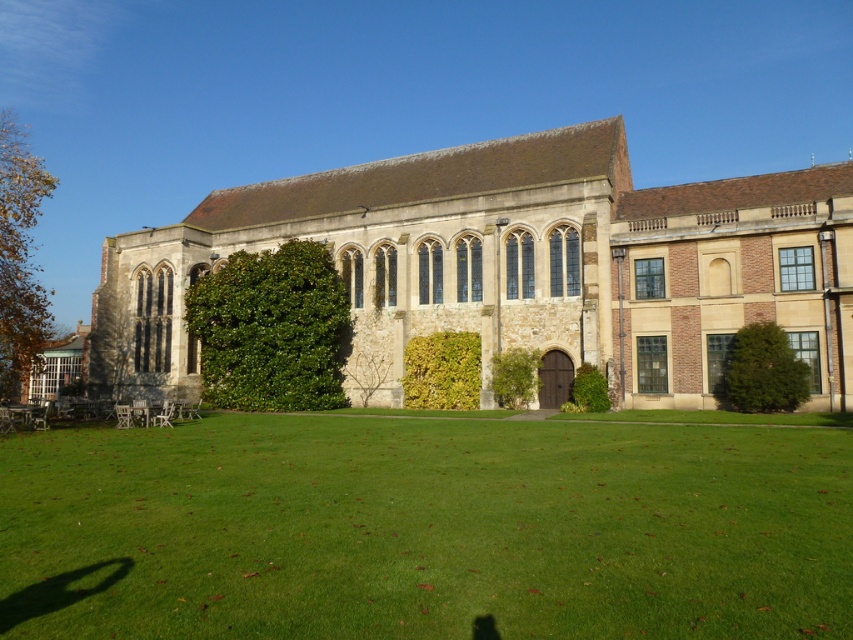
Is green grass at lower center to the right of stone church at center from the viewer's perspective?

Yes, green grass at lower center is to the right of stone church at center.

Is point (281, 625) positioned in front of point (577, 225)?

Yes, point (281, 625) is closer to viewer.

The width and height of the screenshot is (853, 640). I want to click on green grass at lower center, so click(424, 529).